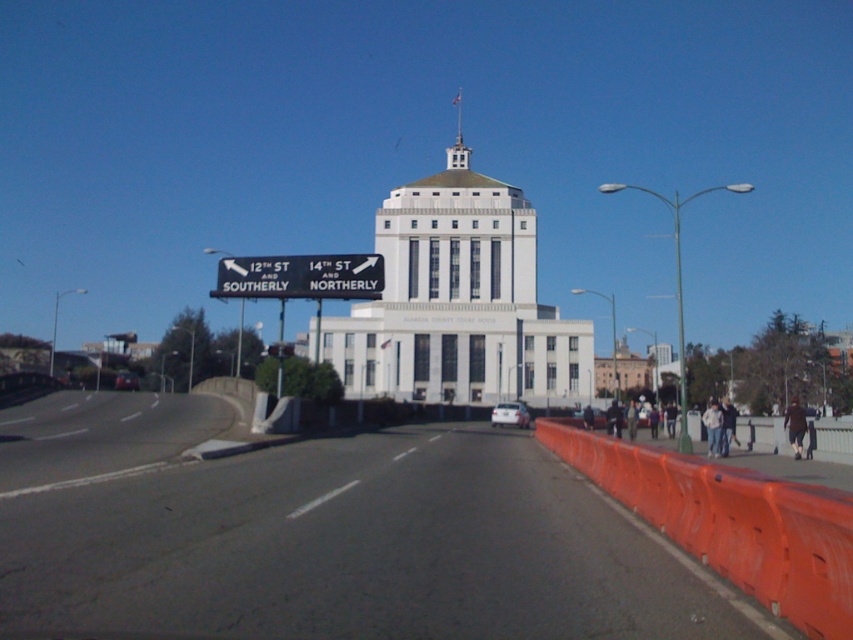
Can you confirm if black plastic sign at upper center is positioned to the left of shiny red car at center?

Incorrect, black plastic sign at upper center is not on the left side of shiny red car at center.

I want to click on black plastic sign at upper center, so click(300, 276).

The height and width of the screenshot is (640, 853). Identify the location of black plastic sign at upper center. (300, 276).

This screenshot has height=640, width=853. Find the location of `black plastic sign at upper center`. black plastic sign at upper center is located at coordinates (300, 276).

Between white matte car at center and shiny red car at center, which one is positioned higher?

shiny red car at center

Locate an element on the screen. white matte car at center is located at coordinates (509, 413).

Looking at this image, does white concrete building at center have a greater width compared to white matte car at center?

Yes, white concrete building at center is wider than white matte car at center.

Which is behind, point (566, 333) or point (508, 422)?

The point (566, 333) is more distant.

Identify the location of white concrete building at center. pyautogui.click(x=457, y=301).

This screenshot has width=853, height=640. In order to click on white concrete building at center in this screenshot , I will do `click(457, 301)`.